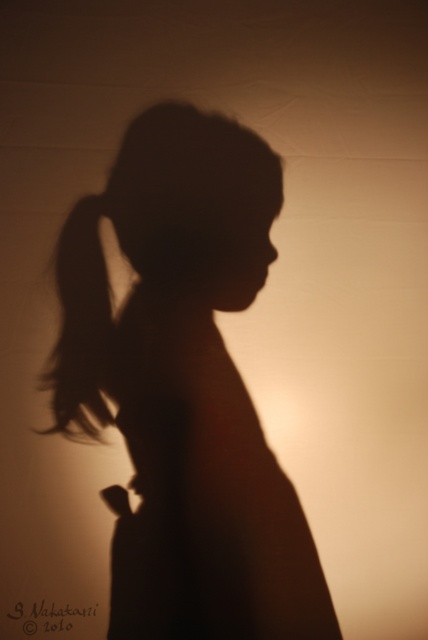
From the picture: You are an artist trying to sketch the scene. You notice the silhouette figure at center and the black hair at left. Which object is positioned closer to you?

The silhouette figure at center is closer to the viewer than the black hair at left.

You are an artist observing the scene. You want to draw the silhouette figure at center and the black hair at left accurately. Which object should you draw first if you follow the rule of drawing larger objects before smaller ones?

The silhouette figure at center should be drawn first because it has a greater height compared to the black hair at left, making it larger.